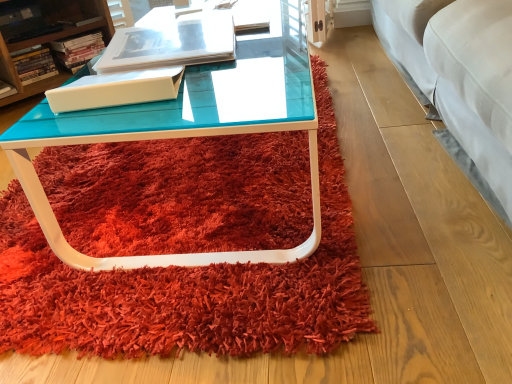
Question: Is matte white book at center, arranged as the 4th book when viewed from the back, closer to the viewer compared to matte white book at upper left, the third book from the left?

Choices:
 (A) no
 (B) yes

Answer: (B)

Question: Can you confirm if matte white book at center, which is counted as the 5th book, starting from the right, is wider than matte white book at upper left, the fifth book positioned from the front?

Choices:
 (A) no
 (B) yes

Answer: (B)

Question: From the image's perspective, is matte white book at center, arranged as the 4th book when viewed from the back, located beneath matte white book at upper left, acting as the first book starting from the back?

Choices:
 (A) no
 (B) yes

Answer: (B)

Question: Is matte white book at center, the 1th book when ordered from left to right, directly adjacent to matte white book at upper left, the fifth book positioned from the front?

Choices:
 (A) no
 (B) yes

Answer: (A)

Question: Is matte white book at center, the 1th book when ordered from left to right, at the right side of matte white book at upper left, the third book from the left?

Choices:
 (A) no
 (B) yes

Answer: (A)

Question: Relative to white glossy book at upper center, the first book from the front, is matte white book at upper left, the fourth book positioned from the left, in front or behind?

Choices:
 (A) behind
 (B) front

Answer: (A)

Question: Is matte white book at upper left, the fourth book positioned from the left, situated inside white glossy book at upper center, the first book from the front, or outside?

Choices:
 (A) inside
 (B) outside

Answer: (B)

Question: In terms of width, does matte white book at upper left, the second book when ordered from right to left, look wider or thinner when compared to white glossy book at upper center, which is the 5th book from back to front?

Choices:
 (A) wide
 (B) thin

Answer: (B)

Question: Considering the positions of point (91, 36) and point (113, 72), is point (91, 36) closer or farther from the camera than point (113, 72)?

Choices:
 (A) farther
 (B) closer

Answer: (A)

Question: Considering the positions of matte white book at upper left, the 3th book from the right, and teal glass coffee table at center in the image, is matte white book at upper left, the 3th book from the right, bigger or smaller than teal glass coffee table at center?

Choices:
 (A) small
 (B) big

Answer: (A)

Question: Is point (95, 18) closer or farther from the camera than point (203, 132)?

Choices:
 (A) closer
 (B) farther

Answer: (B)

Question: From a real-world perspective, is matte white book at upper left, acting as the first book starting from the back, physically located above or below teal glass coffee table at center?

Choices:
 (A) above
 (B) below

Answer: (A)

Question: In the image, is matte white book at upper left, acting as the first book starting from the back, on the left side or the right side of teal glass coffee table at center?

Choices:
 (A) right
 (B) left

Answer: (B)

Question: Does point [x=54, y=48] appear closer or farther from the camera than point [x=35, y=49]?

Choices:
 (A) farther
 (B) closer

Answer: (A)

Question: Which is correct: matte white book at upper left, the second book when ordered from right to left, is inside hardcover book at upper left, which is counted as the third book, starting from the front, or outside of it?

Choices:
 (A) outside
 (B) inside

Answer: (A)